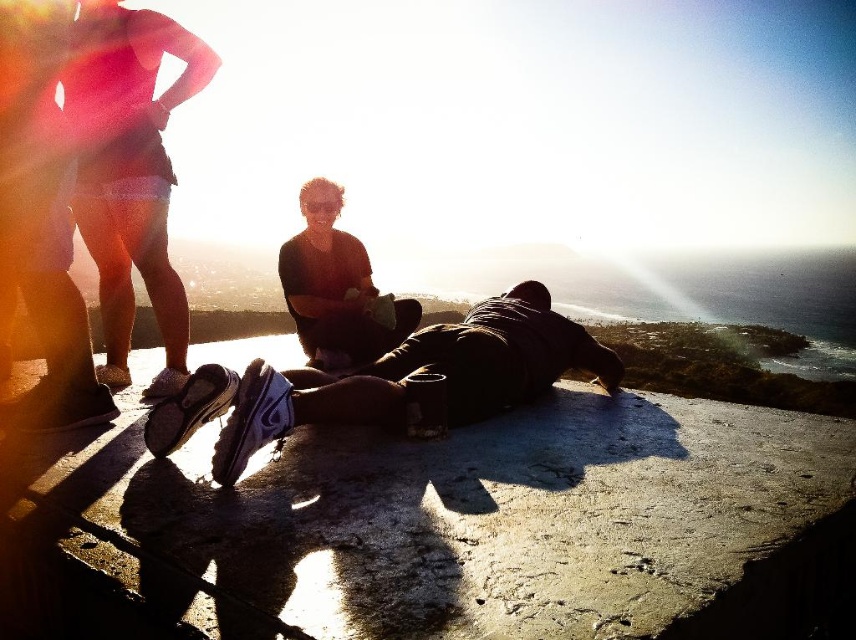
Is dark brown leather jacket at center thinner than matte black shirt at center?

Incorrect, dark brown leather jacket at center's width is not less than matte black shirt at center's.

Consider the image. Does dark brown leather jacket at center have a greater height compared to matte black shirt at center?

Yes.

Where is `dark brown leather jacket at center`? dark brown leather jacket at center is located at coordinates (388, 380).